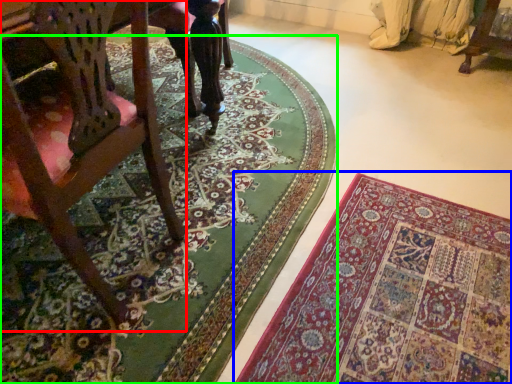
Question: Considering the real-world distances, which object is farthest from chair (highlighted by a red box)? mat (highlighted by a blue box) or mat (highlighted by a green box)?

Choices:
 (A) mat
 (B) mat

Answer: (A)